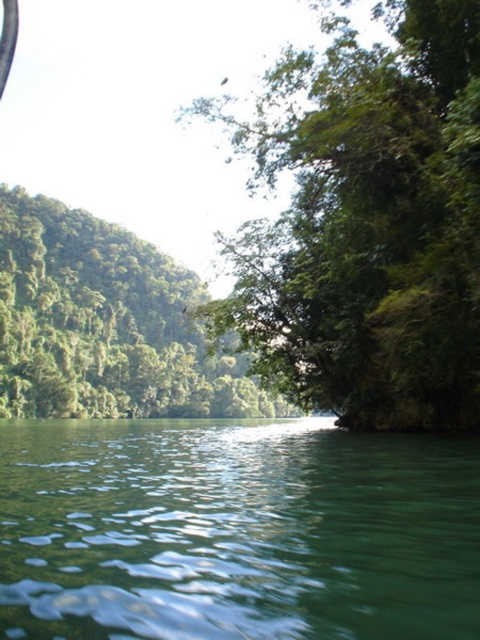
Does green smooth water at lower left appear on the left side of green leafy tree at left?

Incorrect, green smooth water at lower left is not on the left side of green leafy tree at left.

Locate an element on the screen. The image size is (480, 640). green smooth water at lower left is located at coordinates (236, 532).

This screenshot has height=640, width=480. What are the coordinates of `green smooth water at lower left` in the screenshot? It's located at (236, 532).

How much distance is there between green smooth water at lower left and green leafy tree at center?

green smooth water at lower left is 15.24 meters away from green leafy tree at center.

Measure the distance between green smooth water at lower left and camera.

A distance of 5.39 meters exists between green smooth water at lower left and camera.

Where is `green smooth water at lower left`? The height and width of the screenshot is (640, 480). green smooth water at lower left is located at coordinates (236, 532).

Describe the element at coordinates (369, 224) in the screenshot. I see `green leafy tree at center` at that location.

What do you see at coordinates (369, 224) in the screenshot? The image size is (480, 640). I see `green leafy tree at center` at bounding box center [369, 224].

You are a GUI agent. You are given a task and a screenshot of the screen. Output one action in this format:
    pyautogui.click(x=<x>, y=<y>)
    Task: Click on the green leafy tree at center
    This screenshot has width=480, height=640.
    Given the screenshot: What is the action you would take?
    click(x=369, y=224)